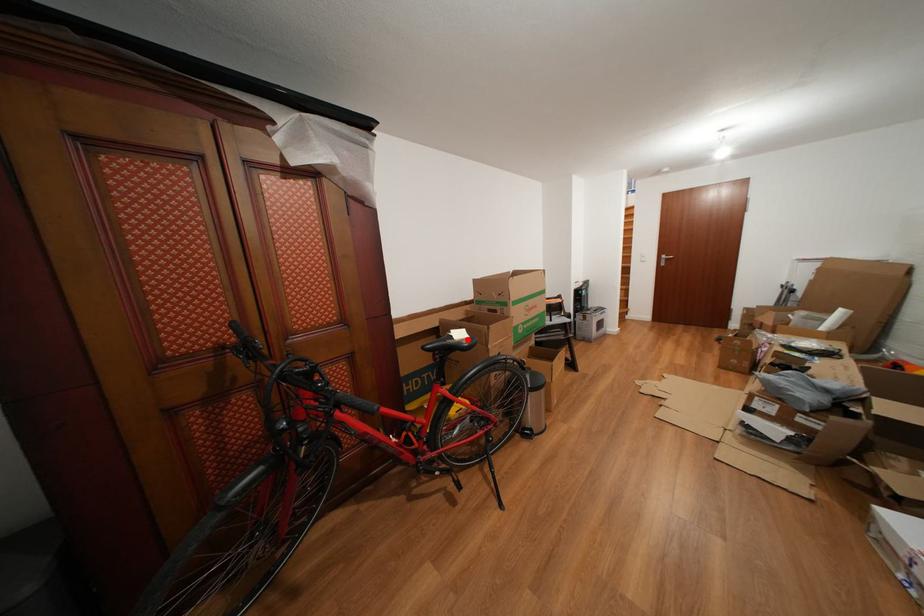
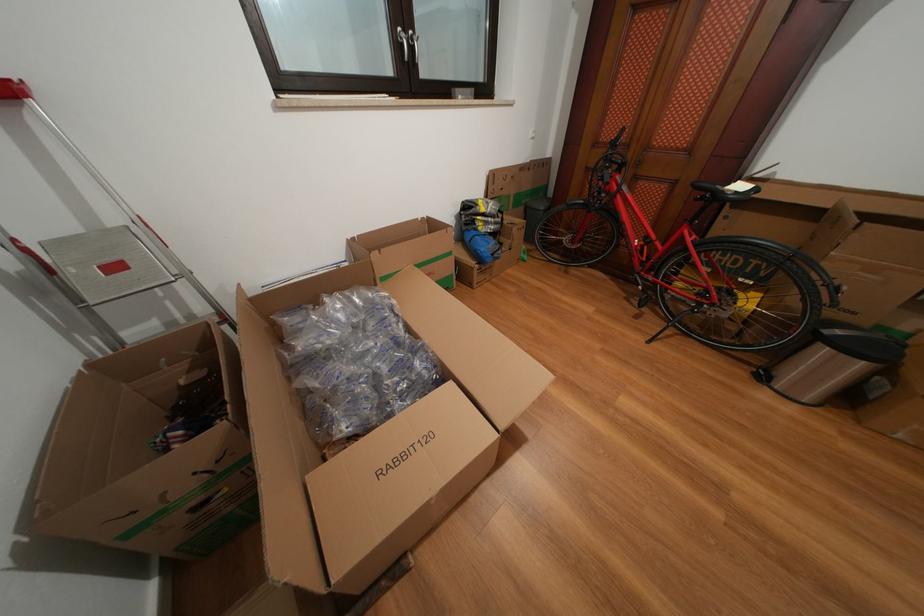
In the second image, find the point that corresponds to the highlighted location in the first image.

(747, 192)